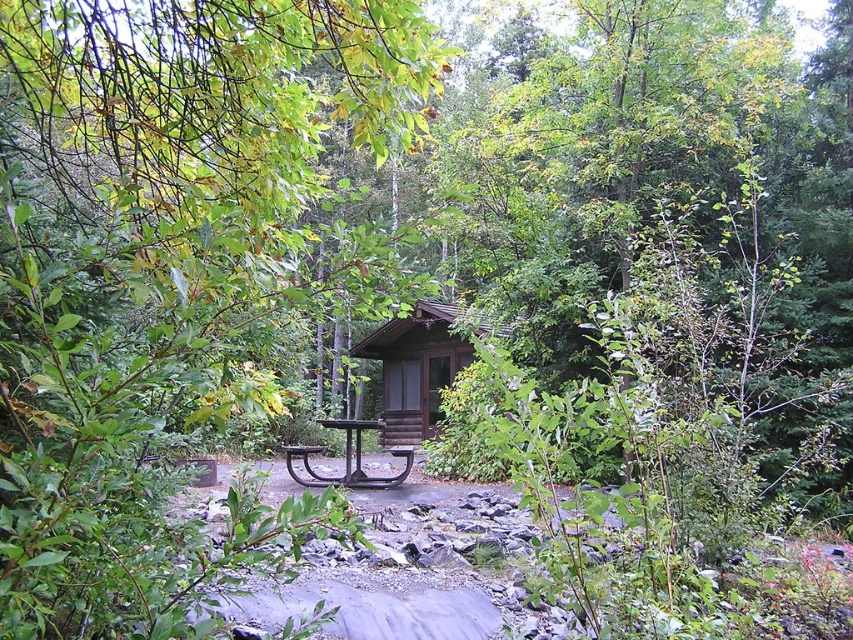
Does point (115, 429) come behind point (318, 484)?

No, it is not.

Does green leafy tree at center come behind black wrought iron picnic table at center?

No, green leafy tree at center is closer to the viewer.

This screenshot has height=640, width=853. I want to click on green leafy tree at center, so click(x=172, y=272).

Image resolution: width=853 pixels, height=640 pixels. What do you see at coordinates (415, 369) in the screenshot?
I see `brown wooden hut at center` at bounding box center [415, 369].

Can you confirm if brown wooden hut at center is wider than black wrought iron picnic table at center?

Indeed, brown wooden hut at center has a greater width compared to black wrought iron picnic table at center.

Find the location of a particular element. brown wooden hut at center is located at coordinates (415, 369).

Does green leafy tree at center have a lesser height compared to brown wooden hut at center?

Yes.

Which is in front, point (347, 310) or point (393, 435)?

Positioned in front is point (347, 310).

This screenshot has width=853, height=640. Identify the location of green leafy tree at center. (172, 272).

In order to click on green leafy tree at center in this screenshot , I will do `click(172, 272)`.